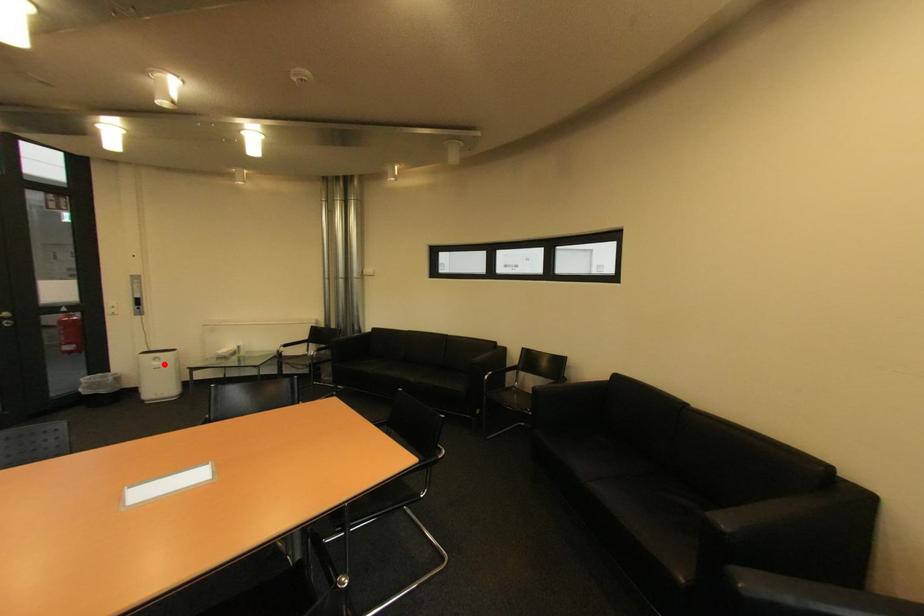
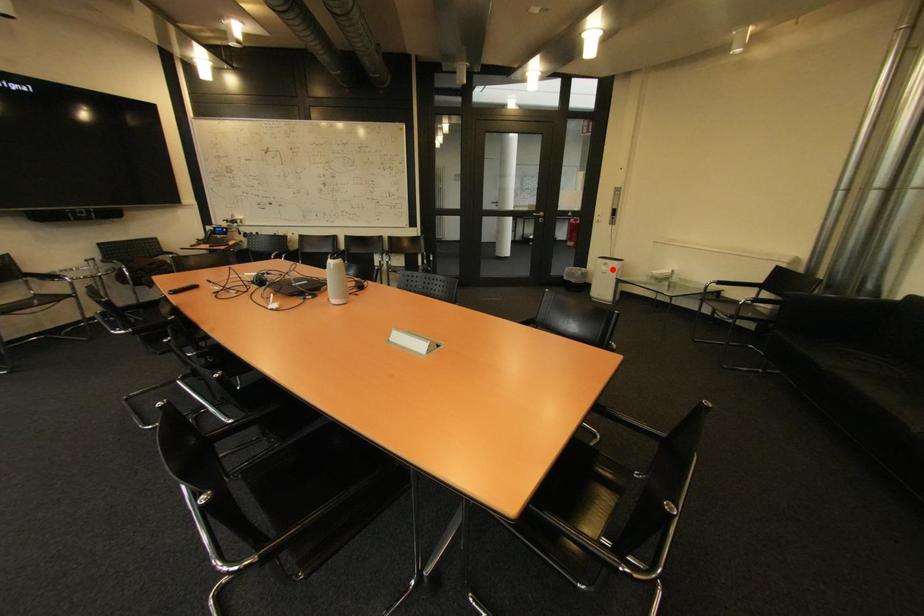
I am providing you with two images of the same scene from different viewpoints. A red point is marked on the first image and another point is marked on the second image. Are the points marked in image1 and image2 representing the same 3D position?

Yes